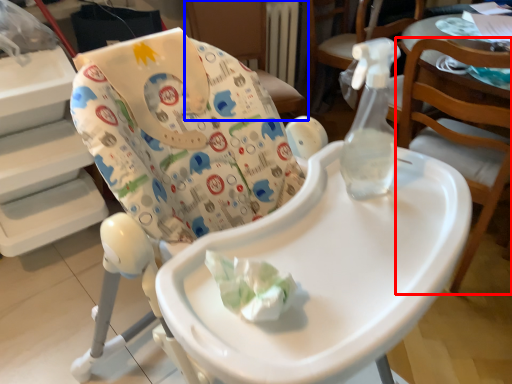
Question: Which object appears closest to the camera in this image, chair (highlighted by a red box) or chair (highlighted by a blue box)?

Choices:
 (A) chair
 (B) chair

Answer: (A)